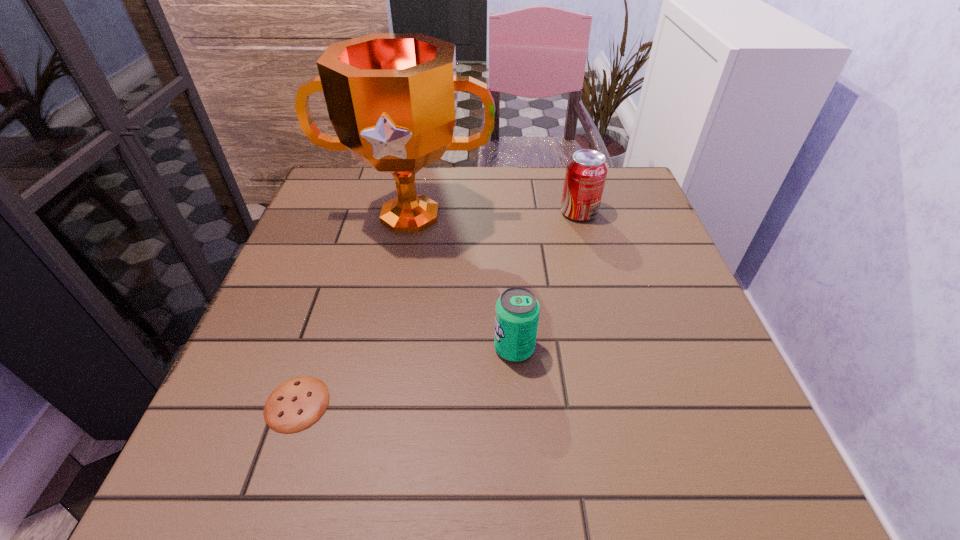
The width and height of the screenshot is (960, 540). In order to click on blank region between the nearer pop soda and the tallest object in this screenshot , I will do `click(462, 282)`.

I want to click on vacant space in between the award and the nearest object, so click(353, 310).

What are the coordinates of `free space between the taller pop soda and the nearest object` in the screenshot? It's located at (438, 308).

This screenshot has height=540, width=960. Find the location of `vacant area that lies between the tallest object and the third shortest object`. vacant area that lies between the tallest object and the third shortest object is located at coordinates point(494,214).

The width and height of the screenshot is (960, 540). Identify the location of vacant space in between the tallest object and the shortest object. (353, 310).

The width and height of the screenshot is (960, 540). Identify the location of empty location between the award and the taller pop soda. (494, 214).

You are a GUI agent. You are given a task and a screenshot of the screen. Output one action in this format:
    pyautogui.click(x=<x>, y=<y>)
    Task: Click on the vacant area between the nearest object and the award
    Image resolution: width=960 pixels, height=540 pixels.
    Given the screenshot: What is the action you would take?
    pyautogui.click(x=353, y=310)

This screenshot has height=540, width=960. What are the coordinates of `vacant space that is in between the rightmost object and the third farthest object` in the screenshot? It's located at 546,280.

Identify which object is the second closest to the tallest object. Please provide its 2D coordinates. Your answer should be formatted as a tuple, i.e. [(x, y)], where the tuple contains the x and y coordinates of a point satisfying the conditions above.

[(517, 312)]

Identify the location of the third closest object to the nearest object. The width and height of the screenshot is (960, 540). (586, 171).